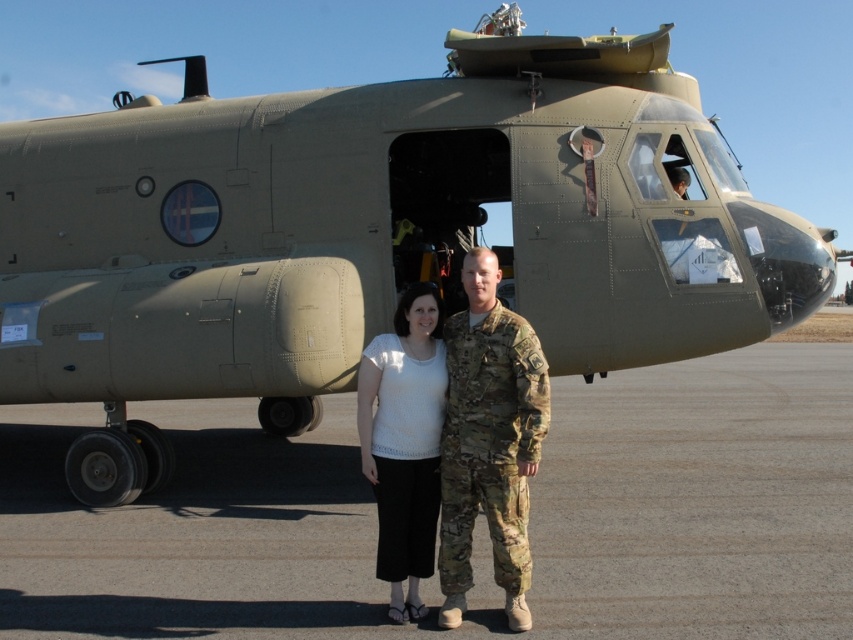
You are standing at the point marked by the coordinates point (699,499). Looking around, you see a gray asphalt at center. Which direction should you face to see the military helicopter?

You should face toward the military helicopter because the gray asphalt at center is located at point (699,499), which is your current position, so facing the helicopter would be the correct direction.

You are a photographer positioned at the origin point of the coordinate system. You want to take a photo of the camouflage uniform at center. What are the coordinates where you should aim your camera?

The coordinates to aim the camera are at point (489, 440) to capture the camouflage uniform at center.

You are a photographer trying to capture a clear shot of the camouflage uniform at center without including the gray asphalt at center in the frame. Is this possible given their positions?

The gray asphalt at center is positioned under camouflage uniform at center, so it is possible to frame the camouflage uniform at center without showing the gray asphalt at center by adjusting the camera angle to exclude the lower part of the scene.